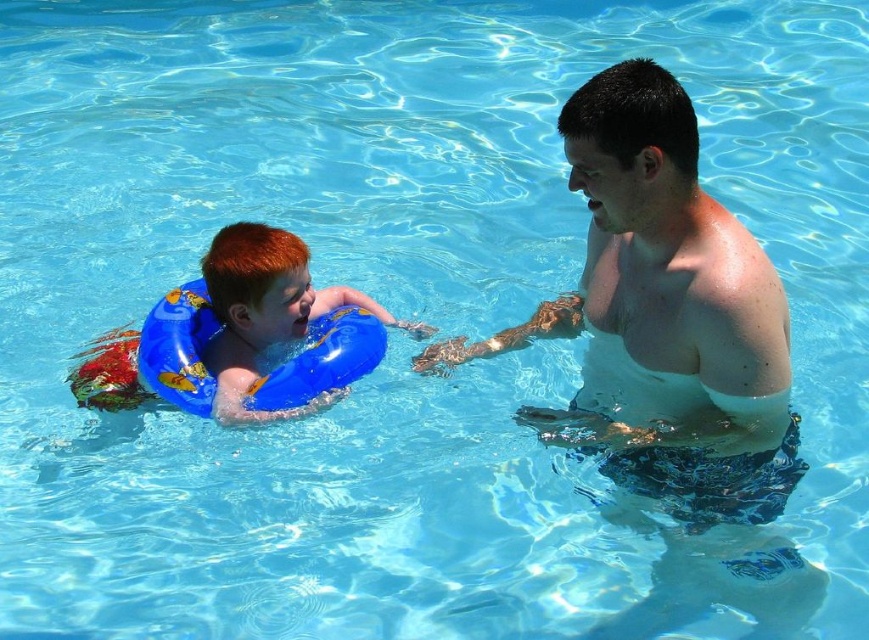
Based on the photo, you are standing on the pool deck and want to toss a beach ball to the smooth skin man at center. If the ball travels in a straight line, will it reach him without hitting any obstacles?

The smooth skin man at center is 3.89 meters away from the viewer. Since there are no obstacles mentioned in the scene, the beach ball should reach him without any issues.

You are observing two points in the swimming pool scene. The first point is labeled as point (779, 477) and the second is point (222, 372). Which of these two points is nearer to you?

Point (779, 477) is closer to the viewer than point (222, 372).